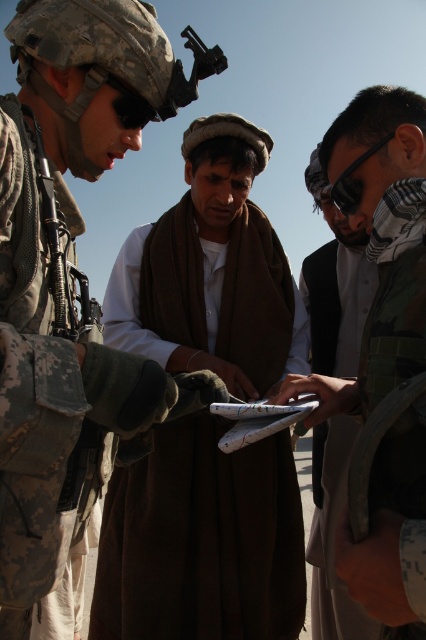
Is white cotton shirt at center further to the viewer compared to brown woolen shawl at center?

That is False.

Does white cotton shirt at center have a greater height compared to brown woolen shawl at center?

Yes.

The image size is (426, 640). What do you see at coordinates (52, 262) in the screenshot?
I see `white cotton shirt at center` at bounding box center [52, 262].

You are a GUI agent. You are given a task and a screenshot of the screen. Output one action in this format:
    pyautogui.click(x=<x>, y=<y>)
    Task: Click on the white cotton shirt at center
    Image resolution: width=426 pixels, height=640 pixels.
    Given the screenshot: What is the action you would take?
    pyautogui.click(x=52, y=262)

Who is taller, brown woolen shawl at center or white fabric shirt at center?

Standing taller between the two is white fabric shirt at center.

Which is behind, point (111, 492) or point (342, 474)?

The point (111, 492) is behind.

Describe the element at coordinates (201, 541) in the screenshot. I see `brown woolen shawl at center` at that location.

Identify the location of brown woolen shawl at center. The width and height of the screenshot is (426, 640). (201, 541).

Who is lower down, brown woolen shawl at center or camouflage fabric uniform at left?

brown woolen shawl at center is lower down.

Does brown woolen shawl at center have a larger size compared to camouflage fabric uniform at left?

Yes.

The image size is (426, 640). I want to click on brown woolen shawl at center, so (201, 541).